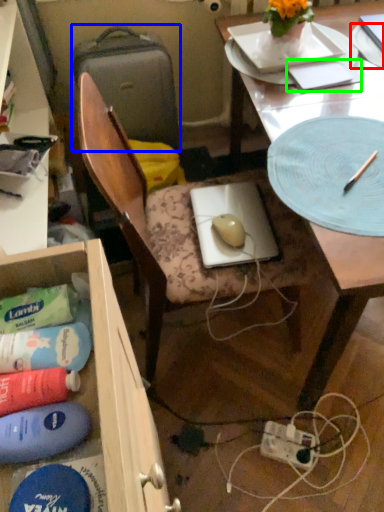
Question: Based on their relative distances, which object is farther from paper plate (highlighted by a red box)? Choose from suitcase (highlighted by a blue box) and notepad (highlighted by a green box).

Choices:
 (A) suitcase
 (B) notepad

Answer: (A)